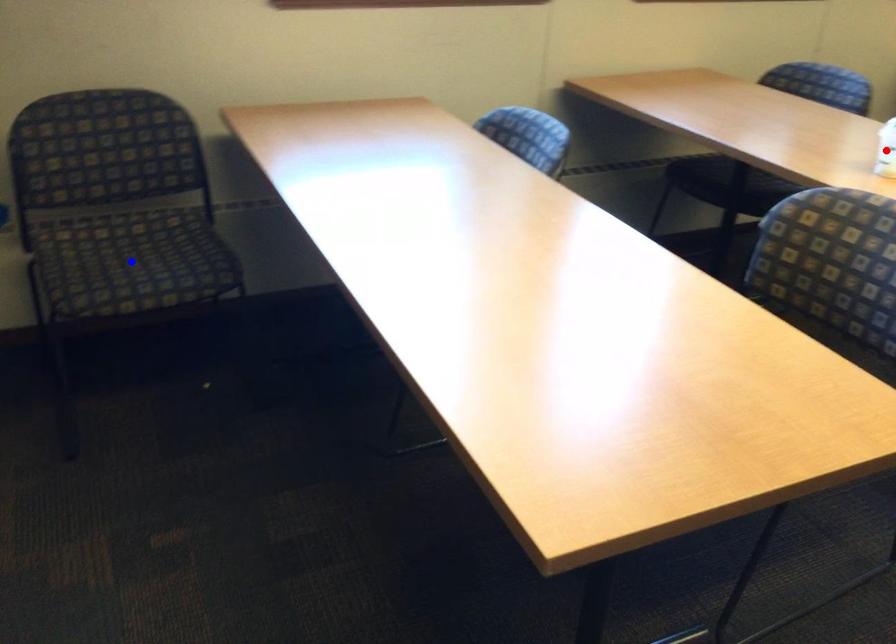
Question: Which of the two points in the image is closer to the camera?

Choices:
 (A) Blue point is closer.
 (B) Red point is closer.

Answer: (B)